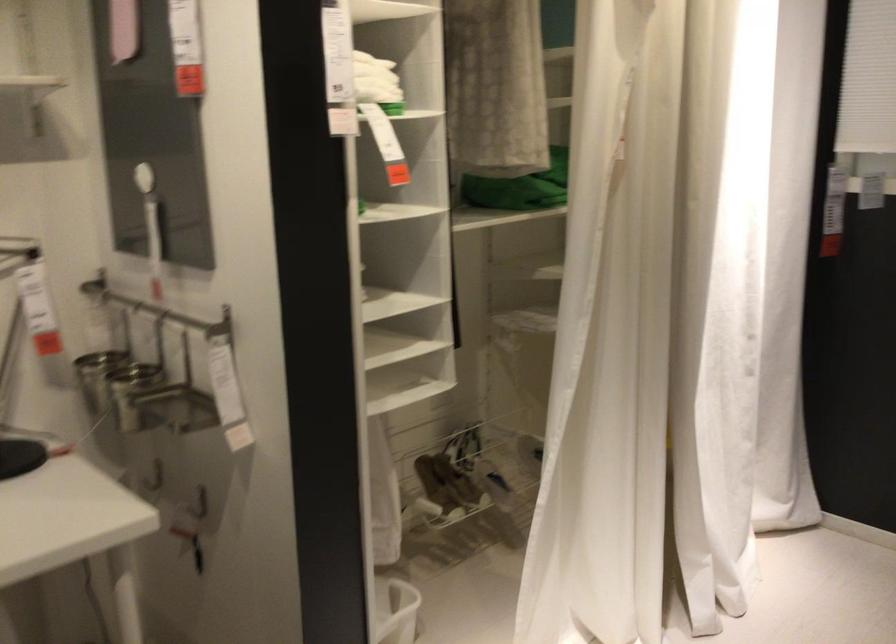
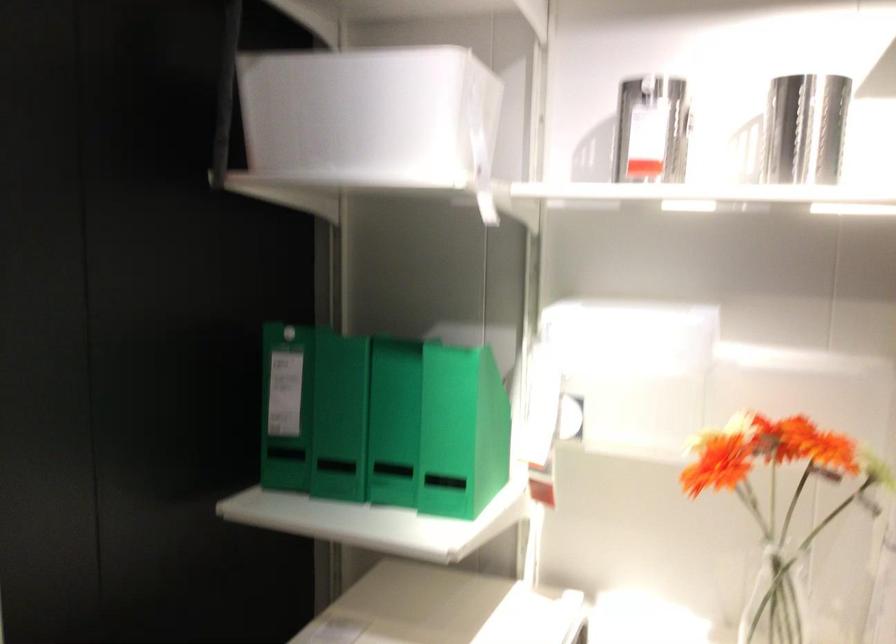
Question: The first image is from the beginning of the video and the second image is from the end. How did the camera likely rotate when shooting the video?

Choices:
 (A) Left
 (B) Right
 (C) Up
 (D) Down

Answer: (A)